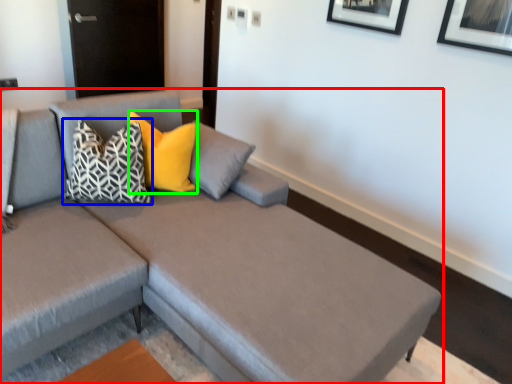
Question: Estimate the real-world distances between objects in this image. Which object is closer to studio couch (highlighted by a red box), pillow (highlighted by a blue box) or pillow (highlighted by a green box)?

Choices:
 (A) pillow
 (B) pillow

Answer: (A)